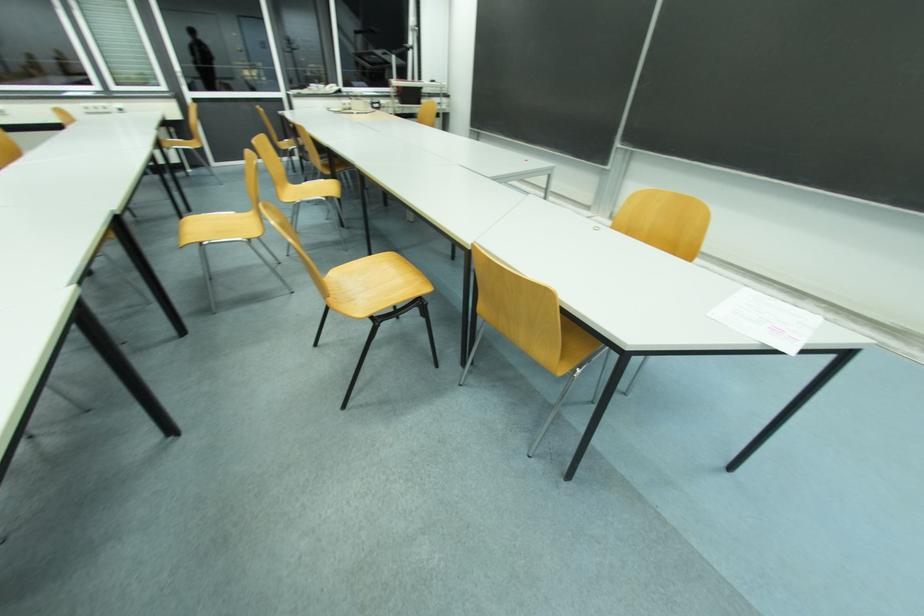
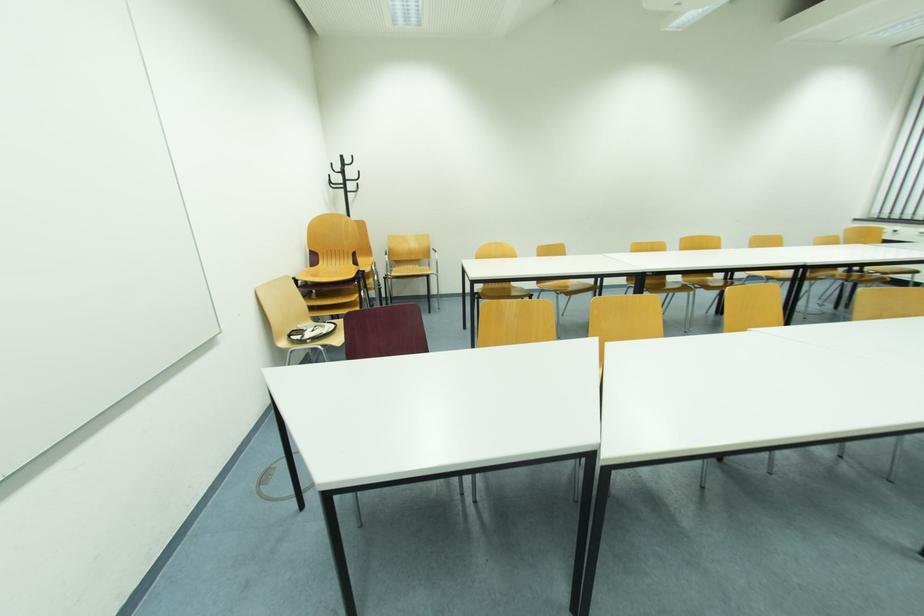
First-person continuous shooting, in which direction is the camera rotating?

The camera rotated toward left-down.